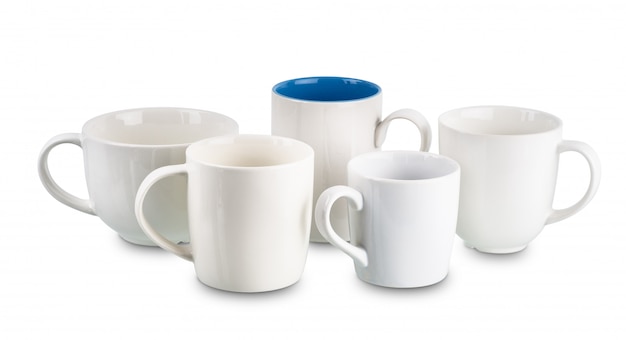
The width and height of the screenshot is (626, 340). Find the location of `white interior of mug`. white interior of mug is located at coordinates pyautogui.click(x=493, y=116), pyautogui.click(x=411, y=166), pyautogui.click(x=263, y=155), pyautogui.click(x=168, y=129).